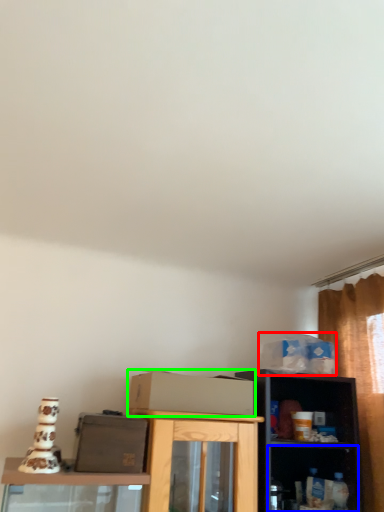
Question: Which object is the closest to the box (highlighted by a red box)? Choose among these: shelf (highlighted by a blue box) or cardboard box (highlighted by a green box).

Choices:
 (A) shelf
 (B) cardboard box

Answer: (A)